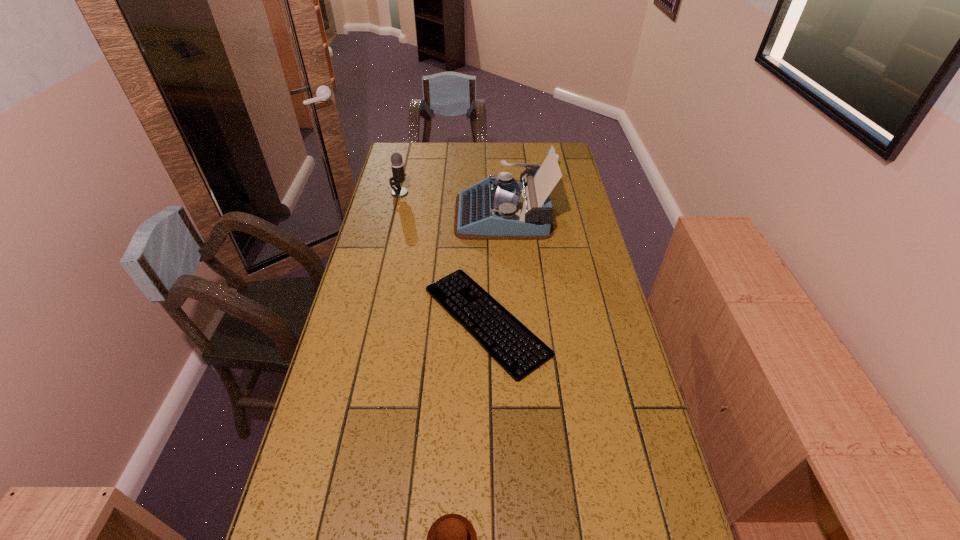
I want to click on vacant space located on the back of the fourth shortest object, so click(405, 168).

Where is `free space located on the front-facing side of the right muffin`? This screenshot has width=960, height=540. free space located on the front-facing side of the right muffin is located at coordinates (561, 211).

You are a GUI agent. You are given a task and a screenshot of the screen. Output one action in this format:
    pyautogui.click(x=<x>, y=<y>)
    Task: Click on the free spot located 0.100m on the left of the computer keyboard
    The width and height of the screenshot is (960, 540).
    Given the screenshot: What is the action you would take?
    [390, 320]

At what (x,y) coordinates should I click in order to perform the action: click on object positioned at the far edge. Please return your answer as a coordinate pair (x, y). This screenshot has width=960, height=540. Looking at the image, I should click on [x=557, y=156].

Find the location of a particular element. This screenshot has width=960, height=540. object that is at the left edge is located at coordinates (397, 165).

Where is `typewriter at the right edge`? typewriter at the right edge is located at coordinates (501, 208).

Find the location of a particular element. The image size is (960, 540). muffin that is at the right edge is located at coordinates tap(557, 156).

This screenshot has height=540, width=960. Identify the location of object located at the far right corner. (557, 156).

In the image, there is a desktop. At what (x,y) coordinates should I click in order to perform the action: click on vacant space at the far edge. Please return your answer as a coordinate pair (x, y). Looking at the image, I should click on (495, 166).

In the image, there is a desktop. Identify the location of free space at the left edge. (379, 407).